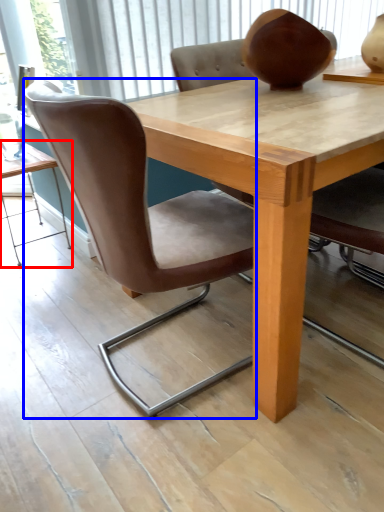
Question: Which object appears farthest to the camera in this image, table (highlighted by a red box) or chair (highlighted by a blue box)?

Choices:
 (A) table
 (B) chair

Answer: (A)